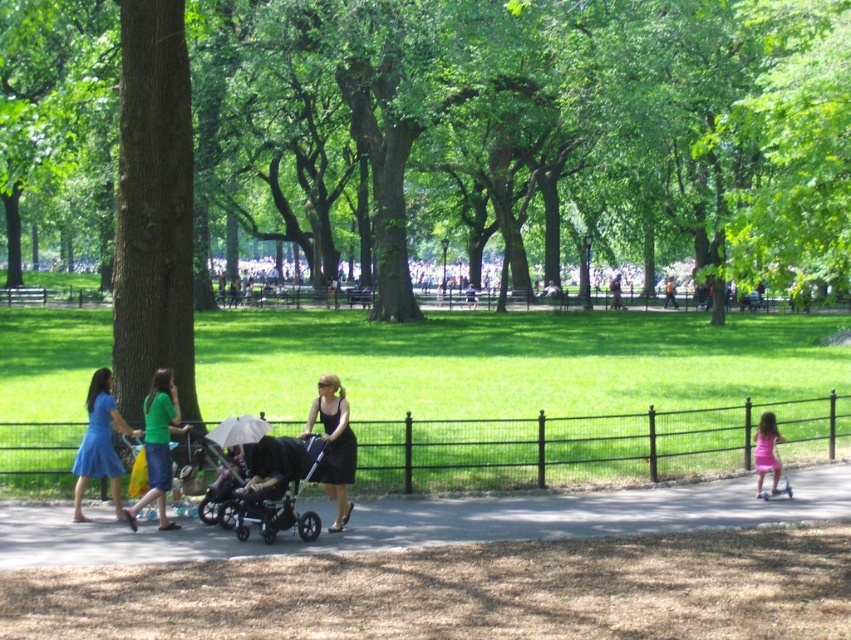
Question: Which object is closer to the camera taking this photo?

Choices:
 (A) black satin dress at center
 (B) green leafy tree at center

Answer: (A)

Question: Does green leafy tree at center have a lesser width compared to black satin dress at center?

Choices:
 (A) yes
 (B) no

Answer: (B)

Question: Which point is farther to the camera?

Choices:
 (A) pink satin dress at lower right
 (B) black satin dress at center
 (C) green leafy tree at center
 (D) matte blue dress at left

Answer: (C)

Question: Which of the following is the closest to the observer?

Choices:
 (A) (117, 422)
 (B) (317, 410)

Answer: (B)

Question: Is green matte dress at center to the right of pink satin dress at lower right from the viewer's perspective?

Choices:
 (A) yes
 (B) no

Answer: (B)

Question: Is the position of smooth asphalt path at center less distant than that of green matte dress at center?

Choices:
 (A) no
 (B) yes

Answer: (B)